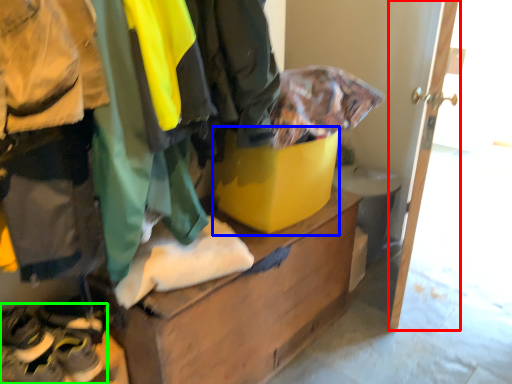
Question: Which is farther away from door (highlighted by a red box)? cardboard box (highlighted by a blue box) or footwear (highlighted by a green box)?

Choices:
 (A) cardboard box
 (B) footwear

Answer: (B)